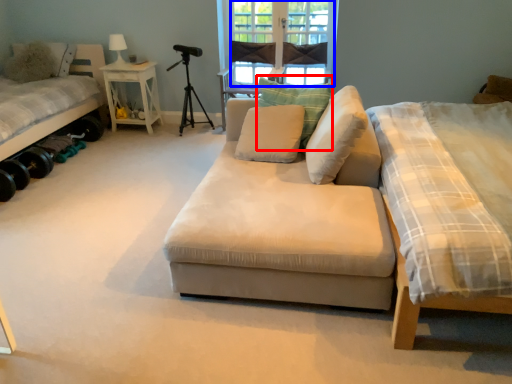
Question: Which object appears farthest to the camera in this image, pillow (highlighted by a red box) or window screen (highlighted by a blue box)?

Choices:
 (A) pillow
 (B) window screen

Answer: (B)